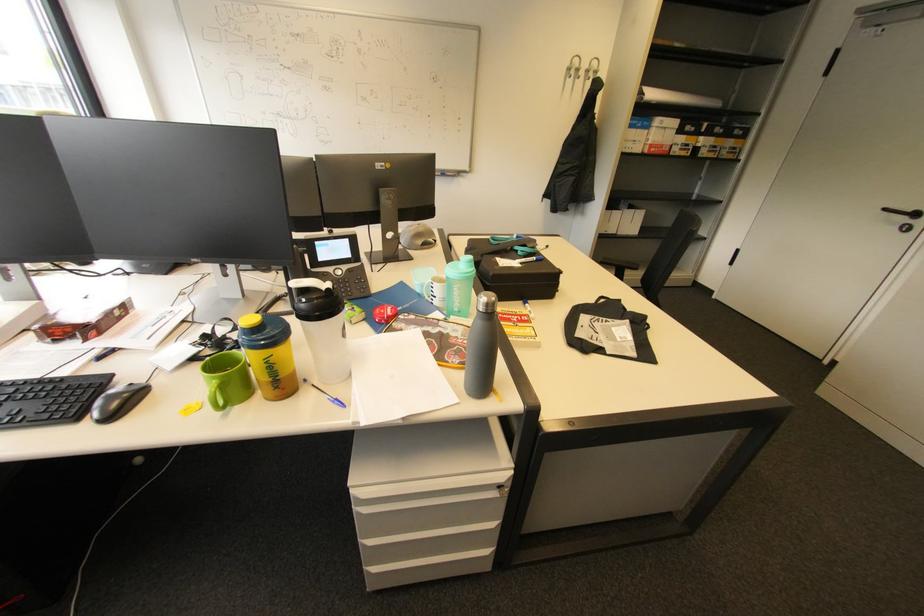
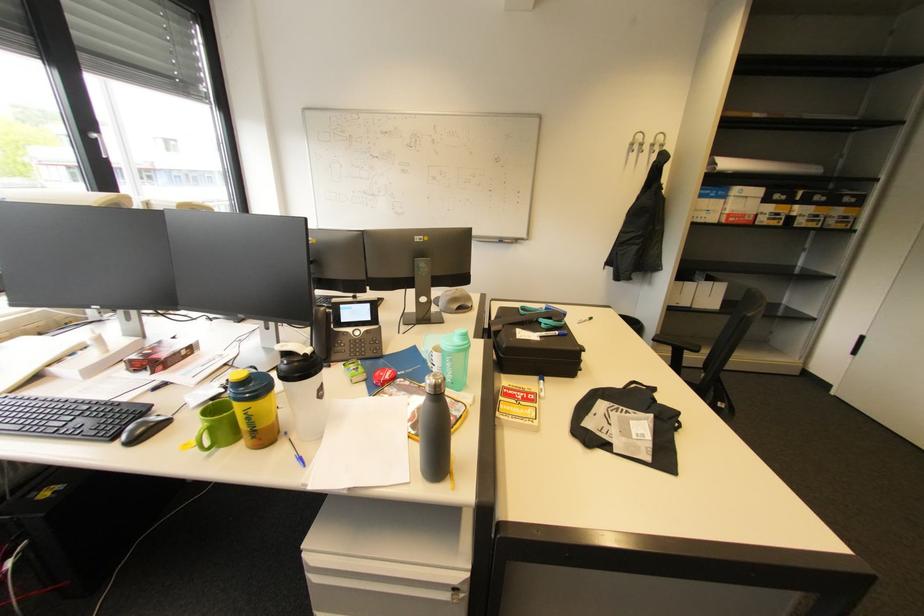
Question: The first image is from the beginning of the video and the second image is from the end. How did the camera likely rotate when shooting the video?

Choices:
 (A) Left
 (B) Right
 (C) Up
 (D) Down

Answer: (A)